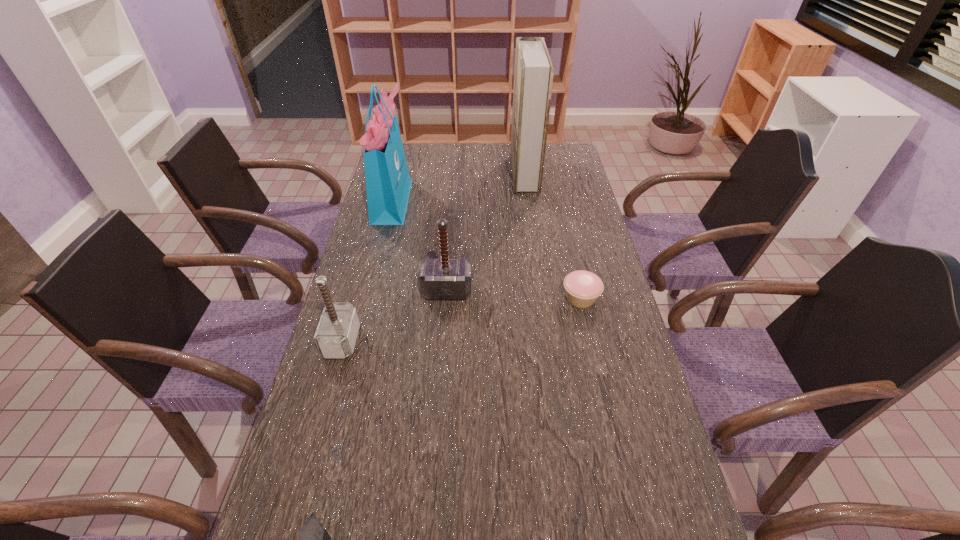
The image size is (960, 540). Identify the location of empty space between the fifth farthest object and the farthest hammer. 395,316.

In order to click on free space between the farthest hammer and the fifth object from left to right in this screenshot , I will do `click(486, 233)`.

The image size is (960, 540). In order to click on vacant space in between the fifth tallest object and the fifth object from left to right in this screenshot , I will do `click(553, 236)`.

This screenshot has width=960, height=540. Find the location of `vacant space that's between the farthest hammer and the second nearest hammer`. vacant space that's between the farthest hammer and the second nearest hammer is located at coordinates (395, 316).

Find the location of a particular element. This screenshot has height=540, width=960. unoccupied area between the phonebook and the farthest hammer is located at coordinates point(486,233).

Find the location of `free space that is in between the shopping bag and the fifth tallest object`. free space that is in between the shopping bag and the fifth tallest object is located at coordinates (487, 249).

This screenshot has height=540, width=960. I want to click on vacant space that's between the cupcake and the second object from right to left, so click(x=553, y=236).

Locate which object is the closest to the shortest hammer. Please provide its 2D coordinates. Your answer should be formatted as a tuple, i.e. [(x, y)], where the tuple contains the x and y coordinates of a point satisfying the conditions above.

[(336, 334)]

Locate an element on the screen. object that is the second nearest to the shopping bag is located at coordinates (533, 74).

Select which hammer is the third closest to the second object from right to left. Please provide its 2D coordinates. Your answer should be formatted as a tuple, i.e. [(x, y)], where the tuple contains the x and y coordinates of a point satisfying the conditions above.

[(313, 539)]